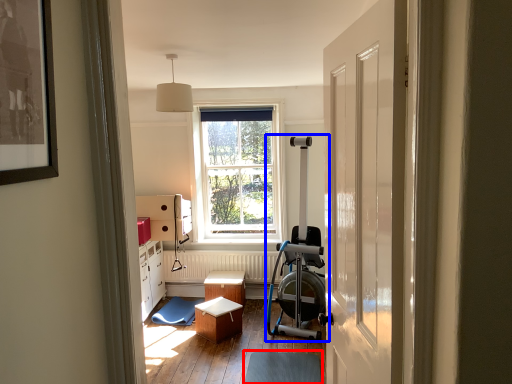
Question: Which of the following is the closest to the observer, footrest (highlighted by a red box) or baby carriage (highlighted by a blue box)?

Choices:
 (A) footrest
 (B) baby carriage

Answer: (A)